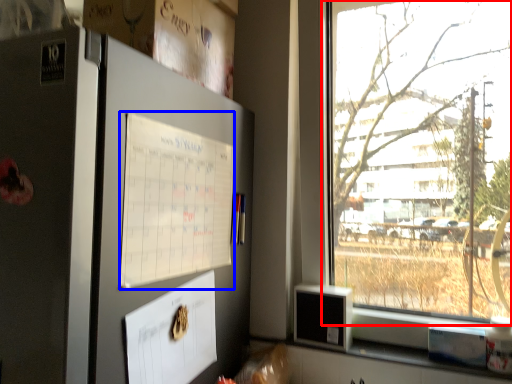
Question: Which point is further to the camera, window (highlighted by a red box) or poster (highlighted by a blue box)?

Choices:
 (A) window
 (B) poster

Answer: (A)